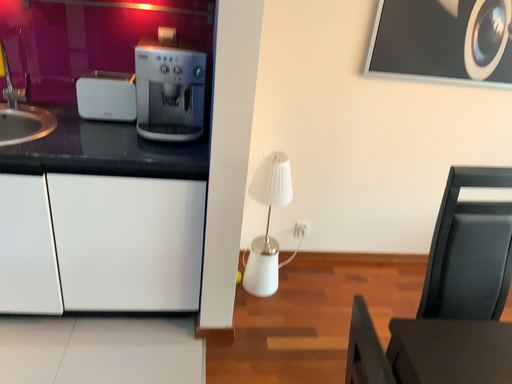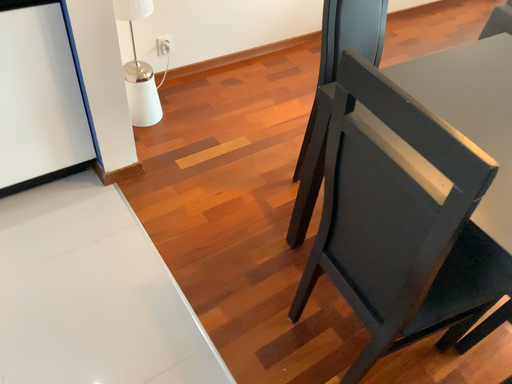
Question: How did the camera likely rotate when shooting the video?

Choices:
 (A) rotated right
 (B) rotated left

Answer: (A)